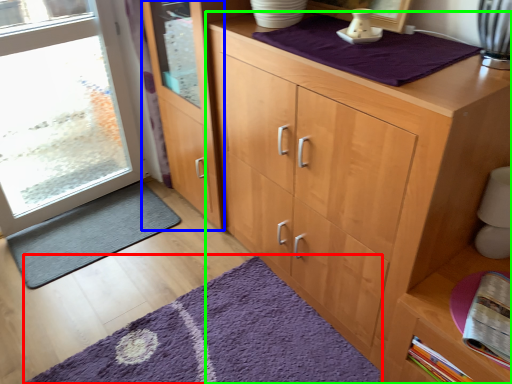
Question: Which object is the farthest from doormat (highlighted by a red box)? Choose among these: screen door (highlighted by a blue box) or cupboard (highlighted by a green box).

Choices:
 (A) screen door
 (B) cupboard

Answer: (A)